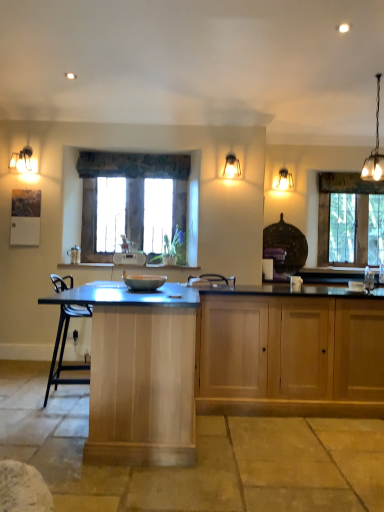
Locate an element on the screen. The image size is (384, 512). free spot below matte white pendant light at upper left, which is the third lamp from right to left (from a real-world perspective) is located at coordinates (15, 361).